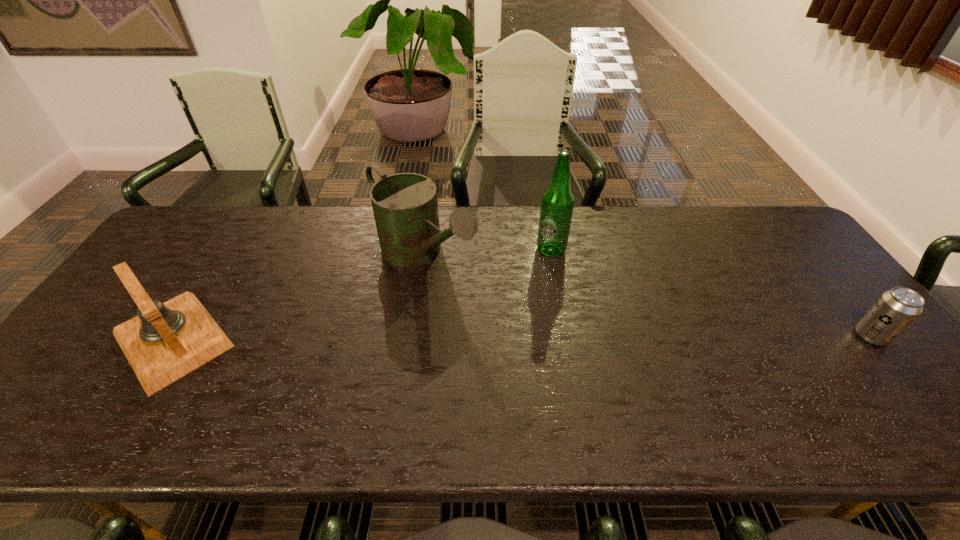
At what (x,y) coordinates should I click in order to perform the action: click on object present at the right edge. Please return your answer as a coordinate pair (x, y). Looking at the image, I should click on (896, 309).

The height and width of the screenshot is (540, 960). Identify the location of object located in the near left corner section of the desktop. (166, 341).

You are a GUI agent. You are given a task and a screenshot of the screen. Output one action in this format:
    pyautogui.click(x=<x>, y=<y>)
    Task: Click on the vacant region at the far edge
    Image resolution: width=960 pixels, height=540 pixels.
    Given the screenshot: What is the action you would take?
    pyautogui.click(x=487, y=241)

In the image, there is a desktop. At what (x,y) coordinates should I click in order to perform the action: click on vacant space at the near edge. Please return your answer as a coordinate pair (x, y). This screenshot has height=540, width=960. Looking at the image, I should click on (781, 388).

Locate an element on the screen. Image resolution: width=960 pixels, height=540 pixels. vacant space at the left edge of the desktop is located at coordinates (154, 272).

Locate an element on the screen. The height and width of the screenshot is (540, 960). free location at the right edge of the desktop is located at coordinates (864, 362).

Image resolution: width=960 pixels, height=540 pixels. What are the coordinates of `vacant point at the far left corner` in the screenshot? It's located at (211, 241).

This screenshot has height=540, width=960. I want to click on vacant space at the near left corner of the desktop, so click(x=35, y=400).

In the image, there is a desktop. Find the location of `vacant space at the near right corner`. vacant space at the near right corner is located at coordinates (863, 389).

Identify the location of free space between the beer bottle and the bell. (362, 295).